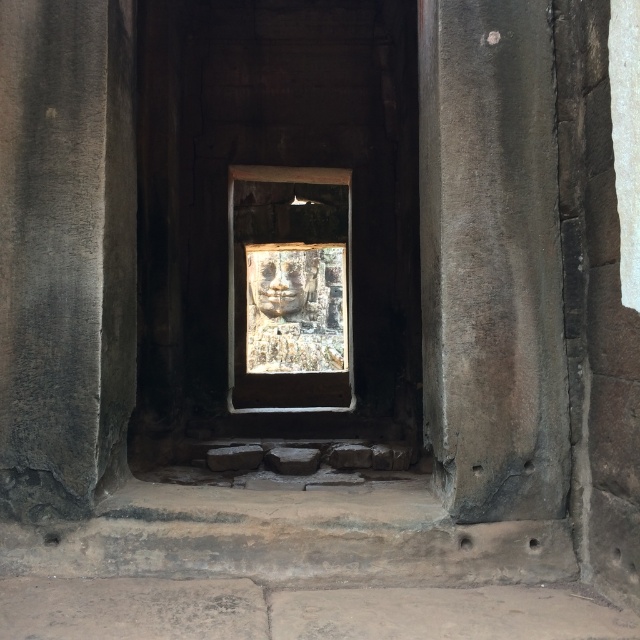
Which is in front, point (83, 81) or point (305, 296)?

Point (83, 81) is more forward.

Is point (17, 506) less distant than point (252, 291)?

Yes, point (17, 506) is closer to viewer.

Identify the location of gray stone pillar at left. This screenshot has width=640, height=640. [x=65, y=252].

Is gray stone pillar at center taller than smooth stone face at center?

Yes, gray stone pillar at center is taller than smooth stone face at center.

This screenshot has height=640, width=640. Identify the location of gray stone pillar at center. (490, 259).

Describe the element at coordinates (490, 259) in the screenshot. The height and width of the screenshot is (640, 640). I see `gray stone pillar at center` at that location.

Find the location of `gray stone pillar at center`. gray stone pillar at center is located at coordinates (490, 259).

Which is behind, point (332, 310) or point (280, 257)?

The point (332, 310) is behind.

Can you confirm if stone carving at center is bigger than smooth stone face at center?

Yes, stone carving at center is bigger than smooth stone face at center.

Locate an element on the screen. stone carving at center is located at coordinates (289, 289).